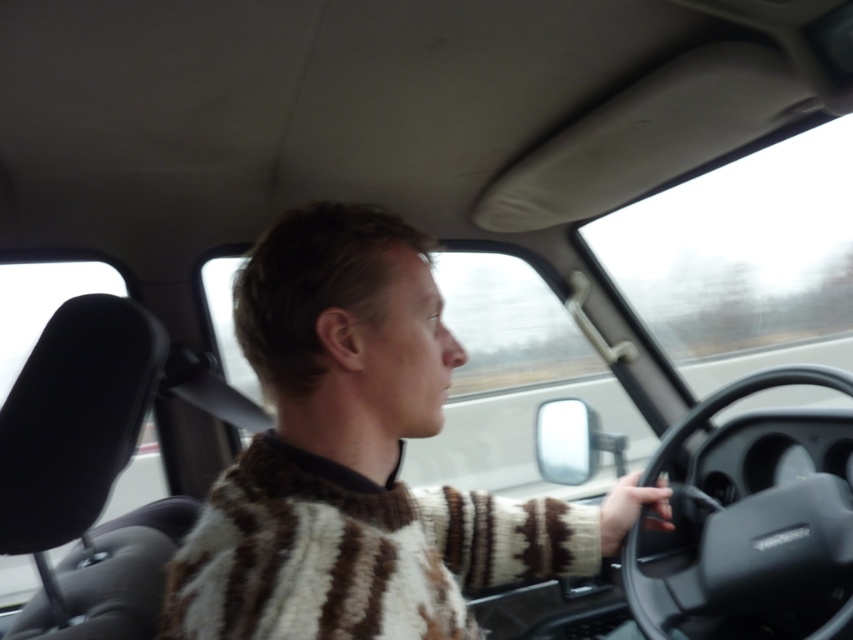
Does striped wool sweater at center have a lesser height compared to black matte steering wheel at center?

In fact, striped wool sweater at center may be taller than black matte steering wheel at center.

Which of these two, striped wool sweater at center or black matte steering wheel at center, stands taller?

striped wool sweater at center is taller.

I want to click on striped wool sweater at center, so click(360, 458).